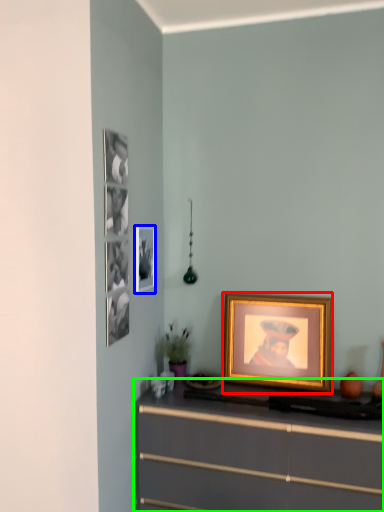
Question: Considering the real-world distances, which object is farthest from picture frame (highlighted by a red box)? picture frame (highlighted by a blue box) or chest of drawers (highlighted by a green box)?

Choices:
 (A) picture frame
 (B) chest of drawers

Answer: (A)